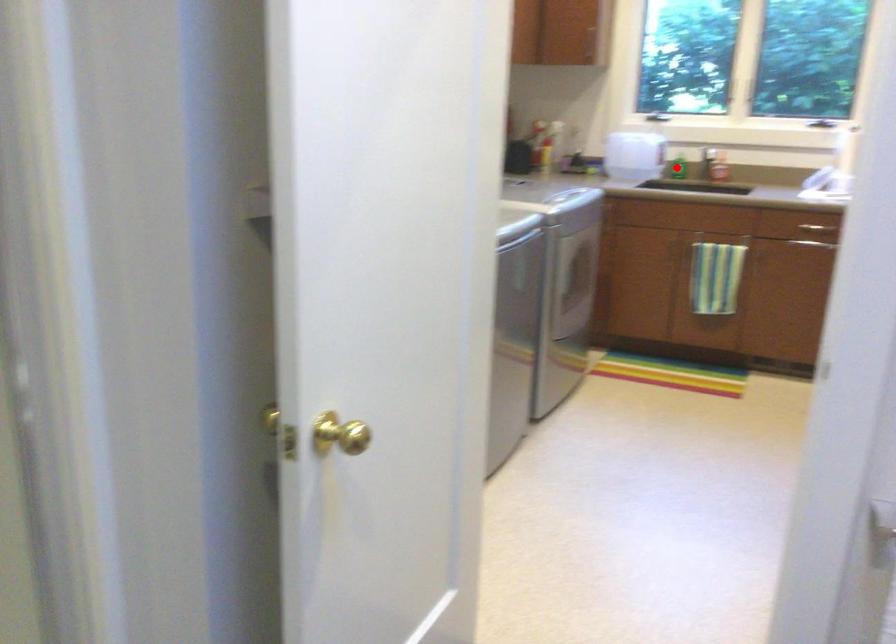
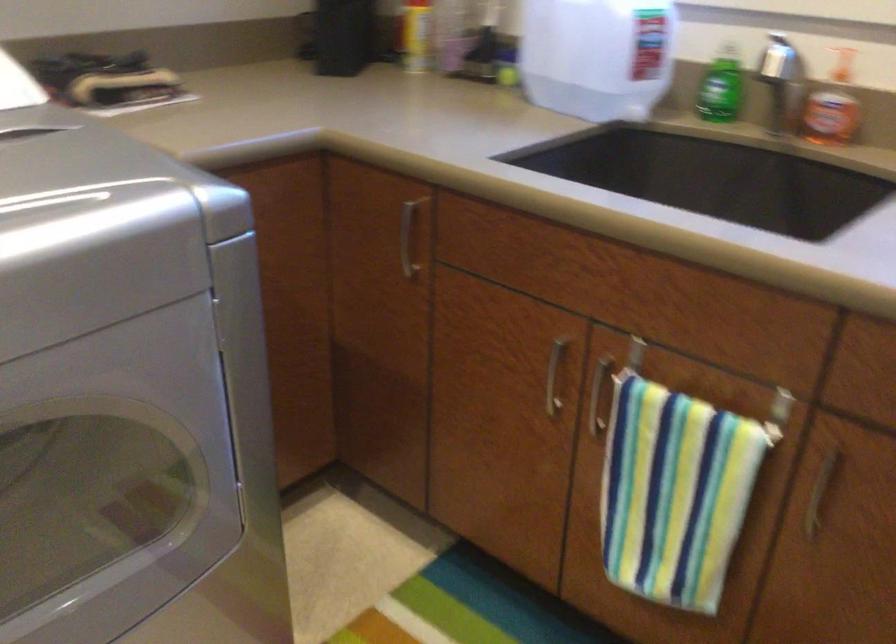
Question: I am providing you with two images of the same scene from different viewpoints. Given a red point in image1, look at the same physical point in image2. Is it:

Choices:
 (A) Closer to the viewpoint
 (B) Farther from the viewpoint

Answer: (A)